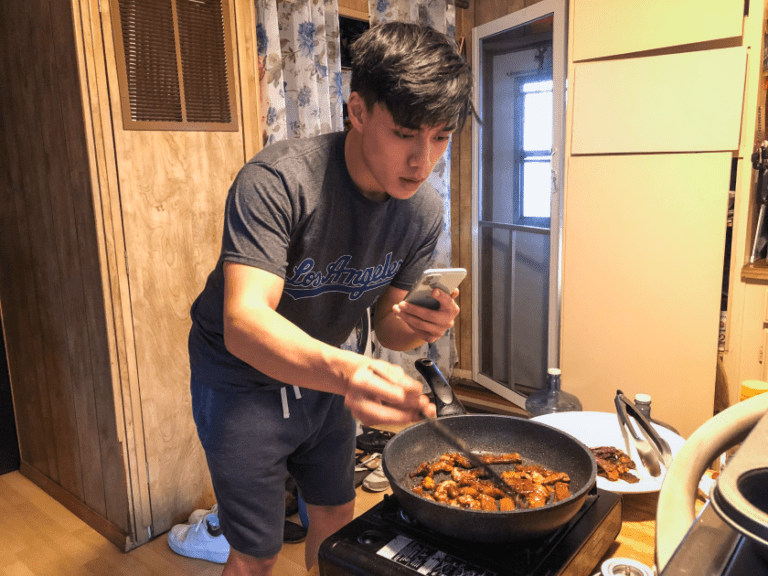
The width and height of the screenshot is (768, 576). In order to click on curtain in this screenshot , I will do `click(286, 83)`.